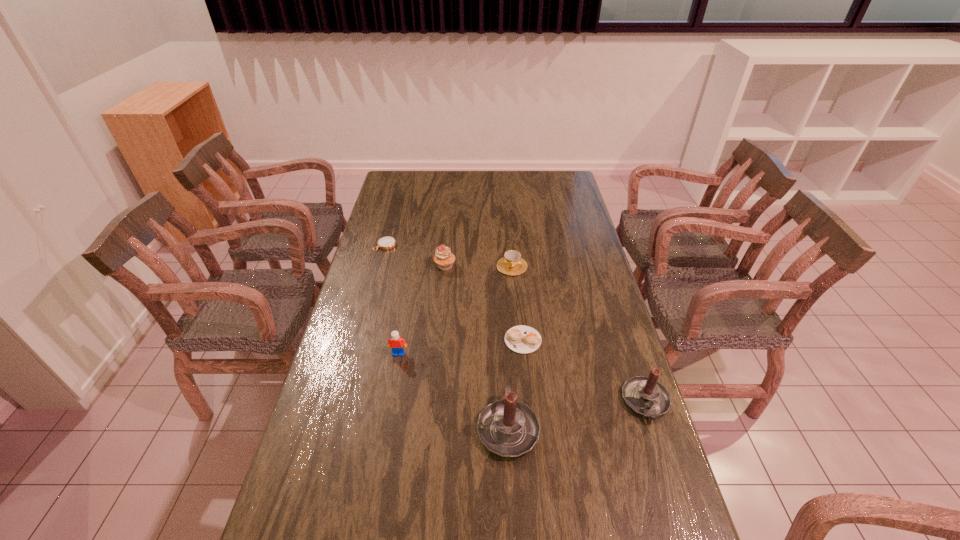
You are a GUI agent. You are given a task and a screenshot of the screen. Output one action in this format:
    pyautogui.click(x=<x>, y=<y>)
    Task: Click on the vacant space located 0.270m on the side of the taller candle with the handle loop
    The height and width of the screenshot is (540, 960).
    Given the screenshot: What is the action you would take?
    pyautogui.click(x=503, y=327)

Locate an element on the screen. blank space located 0.140m on the side of the taller candle with the handle loop is located at coordinates (504, 358).

At what (x,y) coordinates should I click in order to perform the action: click on vacant space situated on the side of the taller candle with the handle loop. Please return your answer as a coordinate pair (x, y). Looking at the image, I should click on (504, 348).

This screenshot has width=960, height=540. Identify the location of vacant region located on the side of the right candle with the handle loop. (684, 517).

Where is `vacant space located with the handle on the side of the cup`? vacant space located with the handle on the side of the cup is located at coordinates (516, 310).

The width and height of the screenshot is (960, 540). What are the coordinates of `free region located on the right of the cupcake` in the screenshot? It's located at (494, 266).

Identify the location of free space located on the back of the shortest object. (393, 218).

Image resolution: width=960 pixels, height=540 pixels. I want to click on free space located 0.400m on the face of the sixth object from right to left, so click(x=374, y=488).

Locate an element on the screen. vacant area located 0.180m on the back of the sixth tallest object is located at coordinates (518, 289).

The width and height of the screenshot is (960, 540). Find the location of `object that is at the left edge`. object that is at the left edge is located at coordinates (385, 243).